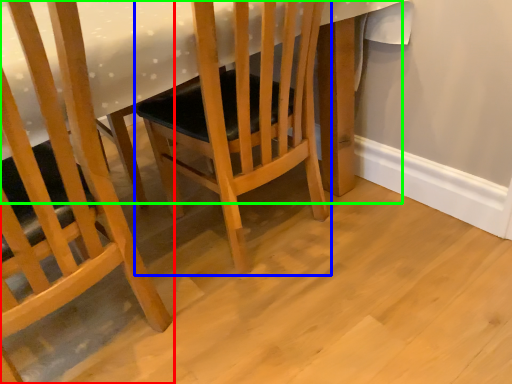
Question: Estimate the real-world distances between objects in this image. Which object is closer to chair (highlighted by a red box), chair (highlighted by a blue box) or table (highlighted by a green box)?

Choices:
 (A) chair
 (B) table

Answer: (B)